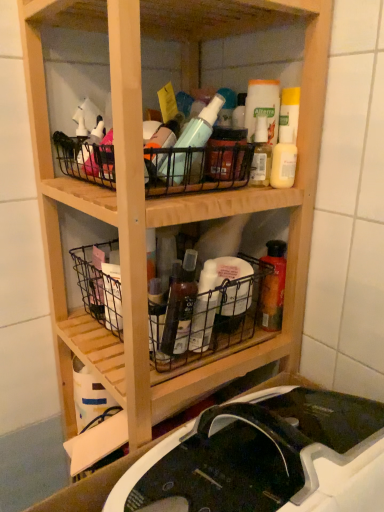
Question: Choose the correct answer: Is metallic wire basket at lower left, placed as the 2th basket when sorted from bottom to top, inside translucent plastic bottle at center, the 1th bottle from the top, or outside it?

Choices:
 (A) inside
 (B) outside

Answer: (B)

Question: Considering the positions of metallic wire basket at lower left, placed as the 2th basket when sorted from bottom to top, and translucent plastic bottle at center, which appears as the 2th bottle when viewed from the left, in the image, is metallic wire basket at lower left, placed as the 2th basket when sorted from bottom to top, bigger or smaller than translucent plastic bottle at center, which appears as the 2th bottle when viewed from the left,?

Choices:
 (A) big
 (B) small

Answer: (A)

Question: Estimate the real-world distances between objects in this image. Which object is farther from the translucent plastic bottle at center, placed as the first bottle when sorted from bottom to top?

Choices:
 (A) black plastic sink at lower center
 (B) matte white bottle at upper right
 (C) black wire basket at upper center, the first basket from the top
 (D) metallic wire basket at lower left, marked as the second basket in a top-to-bottom arrangement
 (E) translucent plastic bottle at center, arranged as the 1th bottle when viewed from the right

Answer: (B)

Question: Which is farther from the black plastic sink at lower center?

Choices:
 (A) black wire basket at upper center, acting as the third basket starting from the bottom
 (B) matte white bottle at upper right
 (C) translucent plastic bottle at center, acting as the second bottle starting from the bottom
 (D) translucent plastic bottle at center, which appears as the 2th bottle when viewed from the right
 (E) metallic wire basket at lower left, placed as the 2th basket when sorted from bottom to top

Answer: (C)